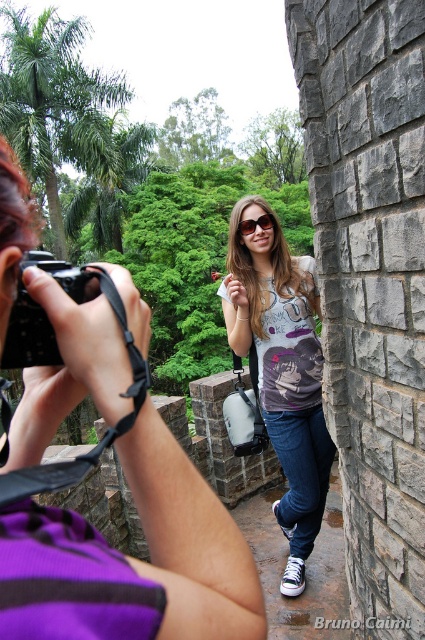
Question: Which object is farther from the camera taking this photo?

Choices:
 (A) matte purple shirt at center
 (B) black plastic camera at left
 (C) matte plastic goggles at center
 (D) matte gray t-shirt at center

Answer: (C)

Question: Which point is farther to the camera?

Choices:
 (A) (241, 234)
 (B) (20, 205)
 (C) (33, 301)
 (D) (266, 259)

Answer: (D)

Question: Based on their relative distances, which object is farther from the black plastic camera at left?

Choices:
 (A) matte purple shirt at center
 (B) matte plastic goggles at center
 (C) matte gray t-shirt at center

Answer: (C)

Question: Can you confirm if black plastic camera at left is smaller than matte plastic goggles at center?

Choices:
 (A) yes
 (B) no

Answer: (B)

Question: Is matte purple shirt at center positioned at the back of matte plastic goggles at center?

Choices:
 (A) no
 (B) yes

Answer: (A)

Question: Is matte purple shirt at center thinner than matte plastic goggles at center?

Choices:
 (A) yes
 (B) no

Answer: (B)